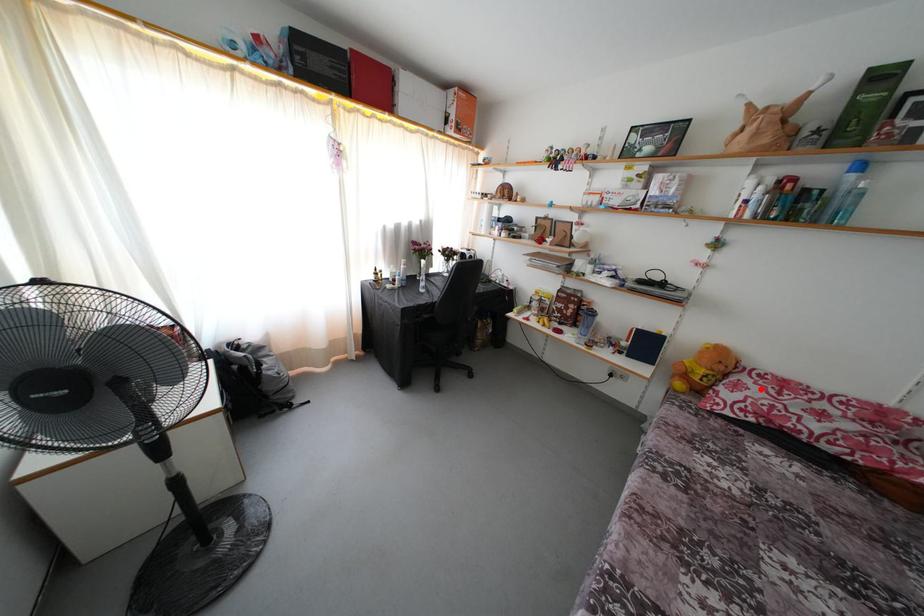
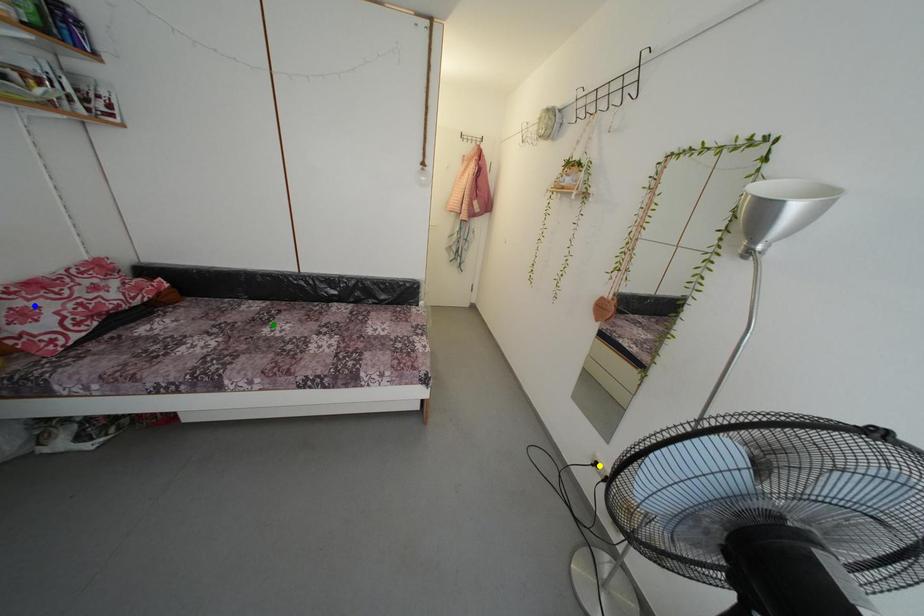
Question: I am providing you with two images of the same scene from different viewpoints. A red point is marked on the first image. You are given multiple points on the second image. Can you choose the point in image 2 that corresponds to the point in image 1?

Choices:
 (A) yellow point
 (B) blue point
 (C) green point

Answer: (B)